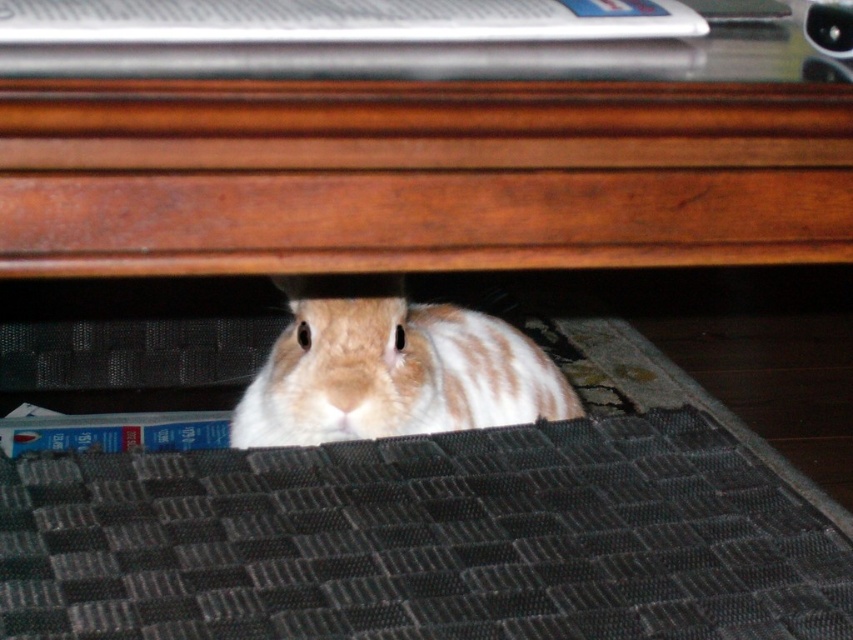
You are trying to determine if the black textured mat at lower center can fully cover the brown and white fur rabbit under the desk. Based on their widths, can the mat cover the rabbit completely?

The black textured mat at lower center has a greater width than the brown and white fur rabbit under the desk, so it can fully cover the rabbit.

You are trying to place a small toy for the rabbit. The toy requires a surface area of 0.5 square meters. Which object between the brown wood table at center and the black textured mat at lower center would be suitable for placing the toy?

The brown wood table at center is larger in size than the black textured mat at lower center, so the brown wood table at center would be suitable for placing the toy as it has enough surface area.